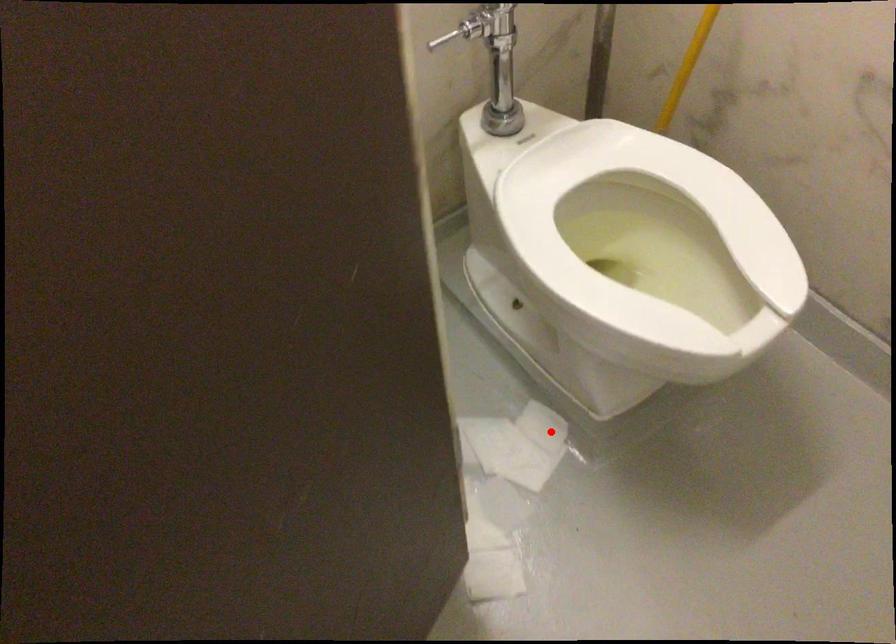
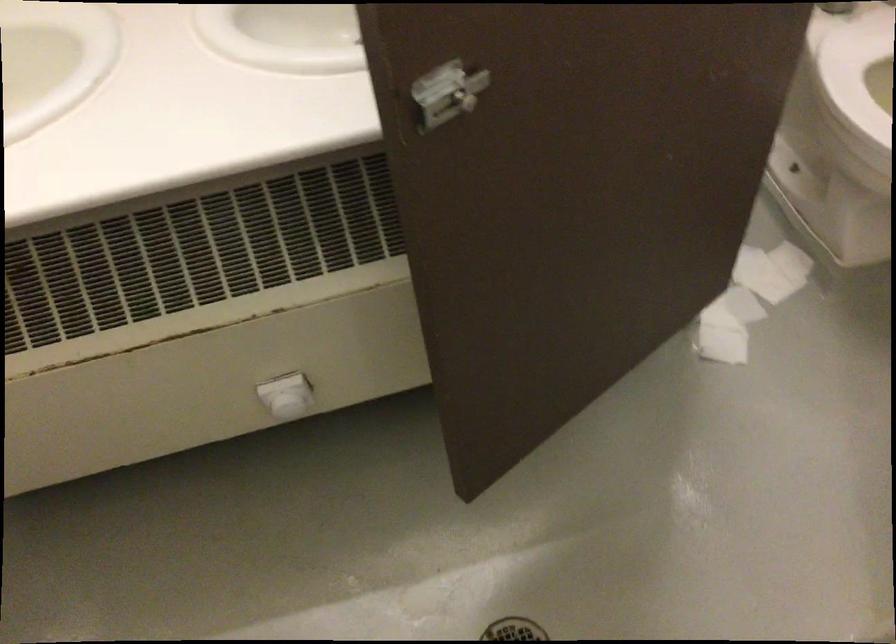
Question: I am providing you with two images of the same scene from different viewpoints. In image1, a red point is highlighted. Considering the same 3D point in image2, which of the following is correct?

Choices:
 (A) It is closer
 (B) It is farther

Answer: (B)